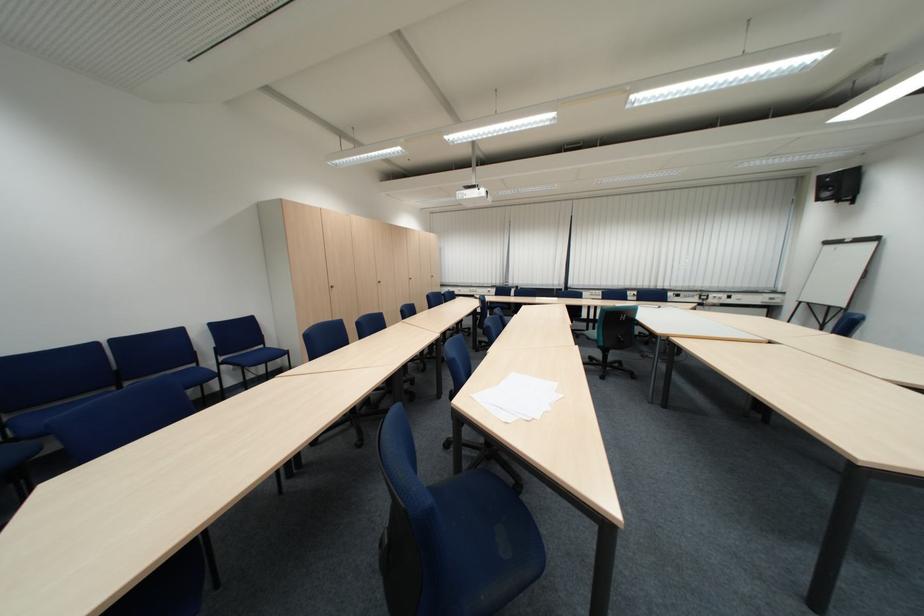
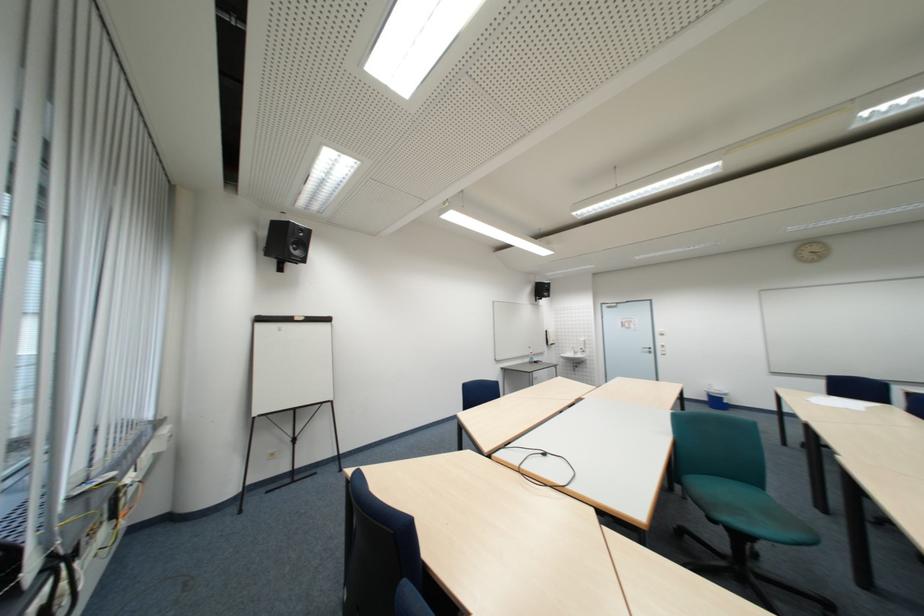
Where in the second image is the point corresponding to (x=842, y=244) from the first image?

(273, 321)